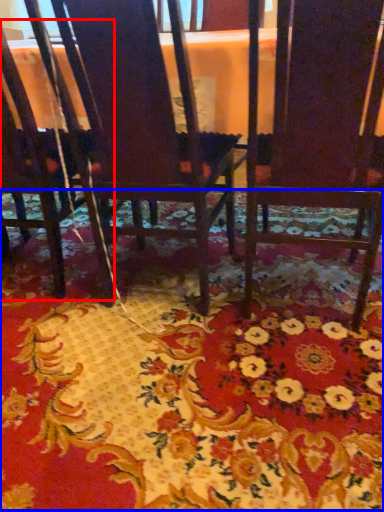
Question: Which object is closer to the camera taking this photo, chair (highlighted by a red box) or mat (highlighted by a blue box)?

Choices:
 (A) chair
 (B) mat

Answer: (B)